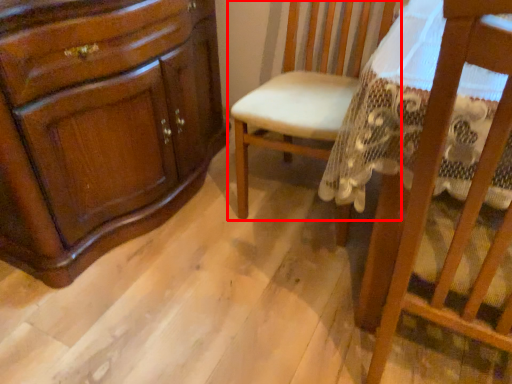
Question: Observing the image, what is the correct spatial positioning of chair (annotated by the red box) in reference to chair?

Choices:
 (A) right
 (B) left

Answer: (B)